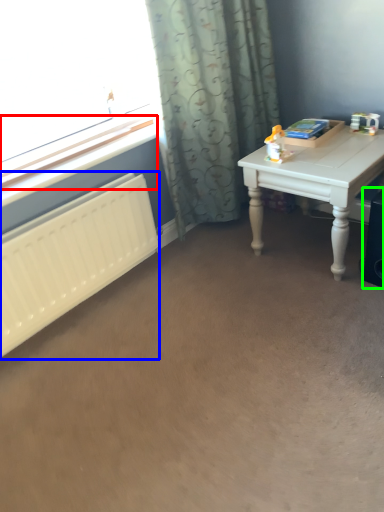
Question: Which is nearer to the window sill (highlighted by a red box)? radiator (highlighted by a blue box) or speaker (highlighted by a green box).

Choices:
 (A) radiator
 (B) speaker

Answer: (A)